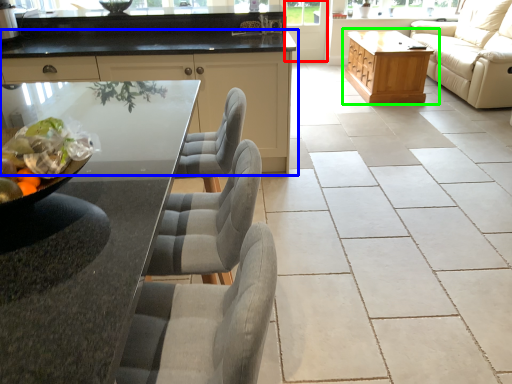
Question: Based on their relative distances, which object is nearer to screen door (highlighted by a red box)? Choose from cabinetry (highlighted by a blue box) and table (highlighted by a green box).

Choices:
 (A) cabinetry
 (B) table

Answer: (B)